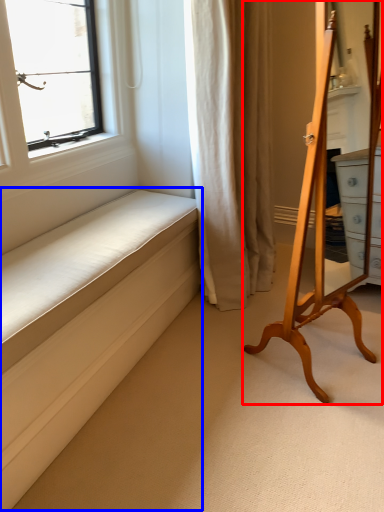
Question: Which object appears farthest to the camera in this image, furniture (highlighted by a red box) or bed frame (highlighted by a blue box)?

Choices:
 (A) furniture
 (B) bed frame

Answer: (A)